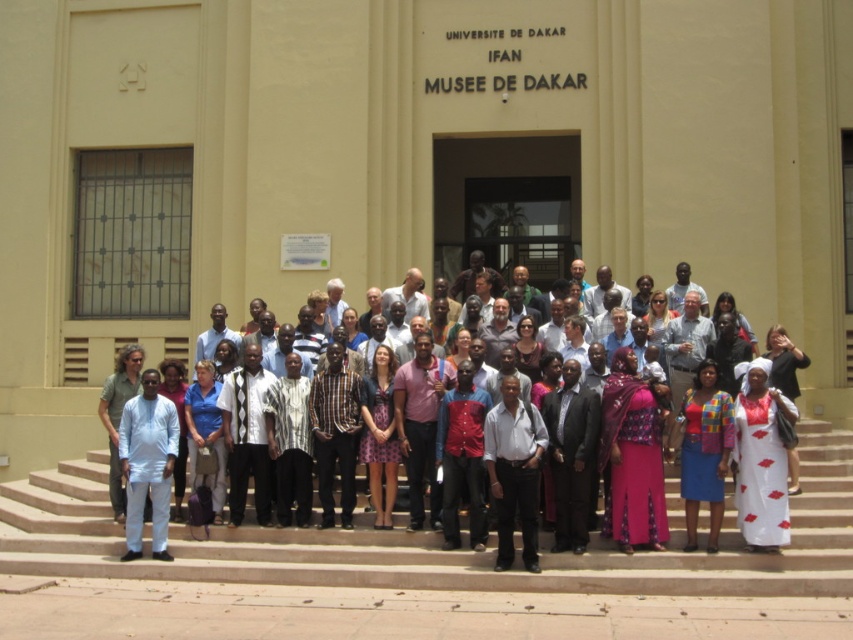
Question: Which point is closer to the camera?

Choices:
 (A) (453, 472)
 (B) (164, 468)
 (C) (758, 509)
 (D) (838, 579)

Answer: (D)

Question: Can you confirm if matte white shirt at center is positioned below beige concrete stairs at center?

Choices:
 (A) no
 (B) yes

Answer: (A)

Question: Does matte white shirt at center appear on the right side of light blue fabric shirt at center?

Choices:
 (A) yes
 (B) no

Answer: (A)

Question: Which of the following is the farthest from the observer?

Choices:
 (A) (172, 547)
 (B) (296, 385)
 (C) (140, 476)

Answer: (B)

Question: Which point is farther to the camera?

Choices:
 (A) (735, 444)
 (B) (132, 552)
 (C) (816, 566)
 (D) (595, 442)

Answer: (B)

Question: Does matte white shirt at center appear under beige concrete stairs at center?

Choices:
 (A) no
 (B) yes

Answer: (A)